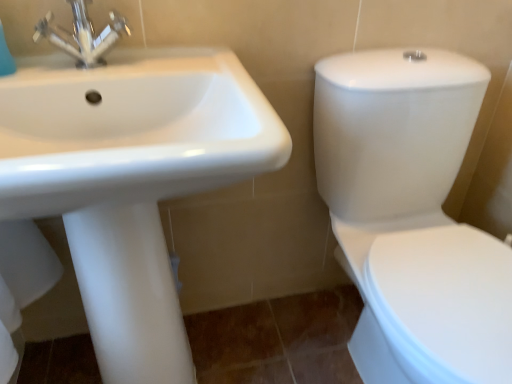
Question: Is point (458, 269) positioned closer to the camera than point (89, 26)?

Choices:
 (A) closer
 (B) farther

Answer: (B)

Question: From the image's perspective, is white glossy toilet at right positioned above or below white glossy sink at upper left?

Choices:
 (A) above
 (B) below

Answer: (A)

Question: Based on their relative distances, which object is farther from the metallic chrome faucet at upper left?

Choices:
 (A) white glossy sink at upper left
 (B) white glossy toilet at right

Answer: (B)

Question: Estimate the real-world distances between objects in this image. Which object is closer to the white glossy sink at upper left?

Choices:
 (A) white glossy toilet at right
 (B) metallic chrome faucet at upper left

Answer: (B)